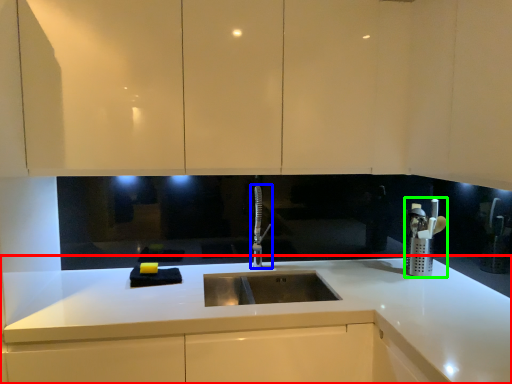
Question: Which object is positioned farthest from countertop (highlighted by a red box)? Select from tap (highlighted by a blue box) and appliance (highlighted by a green box).

Choices:
 (A) tap
 (B) appliance

Answer: (A)